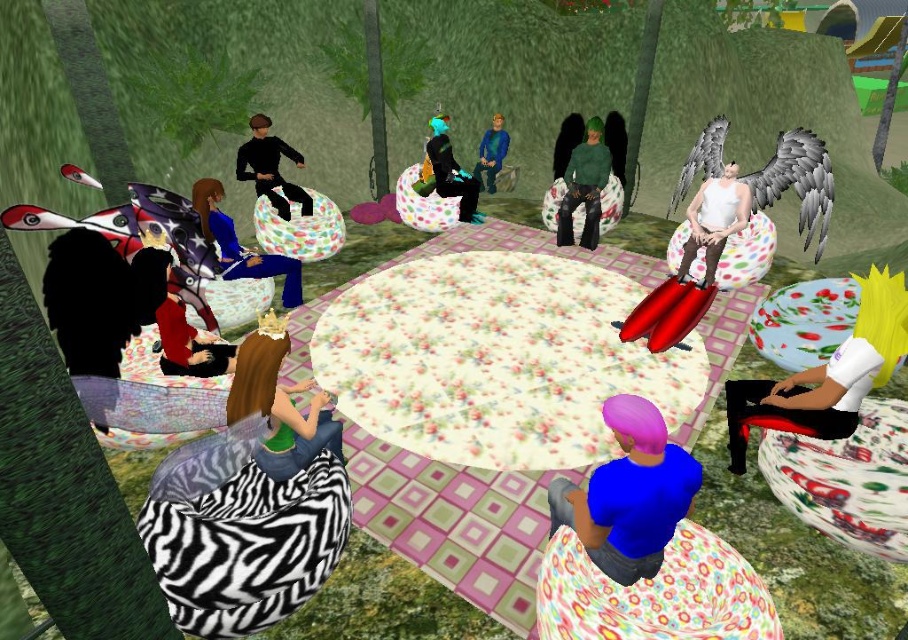
In order to click on floral fabric table at center in this screenshot , I will do `click(496, 358)`.

Can you confirm if floral fabric table at center is smaller than pink matte headband at center?

Actually, floral fabric table at center might be larger than pink matte headband at center.

Is point (336, 298) closer to camera compared to point (687, 467)?

That is False.

Where is `floral fabric table at center`? The width and height of the screenshot is (908, 640). floral fabric table at center is located at coordinates (496, 358).

Identify the location of pink matte headband at center. The image size is (908, 640). (629, 493).

Does pink matte headband at center have a larger size compared to white matte tank top at center?

Actually, pink matte headband at center might be smaller than white matte tank top at center.

Does point (598, 500) lie in front of point (692, 205)?

Yes, point (598, 500) is closer to viewer.

Find the location of a particular element. This screenshot has width=908, height=640. pink matte headband at center is located at coordinates (629, 493).

Does floral fabric table at center have a smaller size compared to green fabric dress at center?

Actually, floral fabric table at center might be larger than green fabric dress at center.

Locate an element on the screen. The width and height of the screenshot is (908, 640). floral fabric table at center is located at coordinates (496, 358).

You are a GUI agent. You are given a task and a screenshot of the screen. Output one action in this format:
    pyautogui.click(x=<x>, y=<y>)
    Task: Click on the floral fabric table at center
    The width and height of the screenshot is (908, 640).
    Given the screenshot: What is the action you would take?
    pyautogui.click(x=496, y=358)